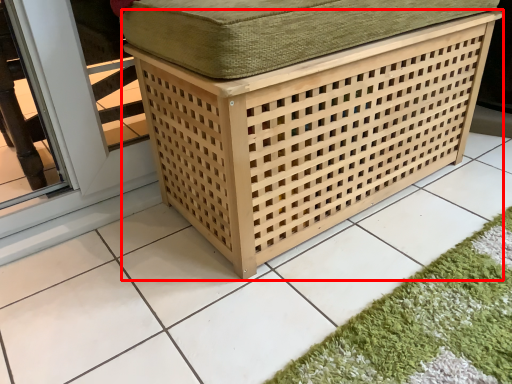
Question: From the image's perspective, where is furniture (annotated by the red box) located in relation to bath mat in the image?

Choices:
 (A) above
 (B) below

Answer: (A)